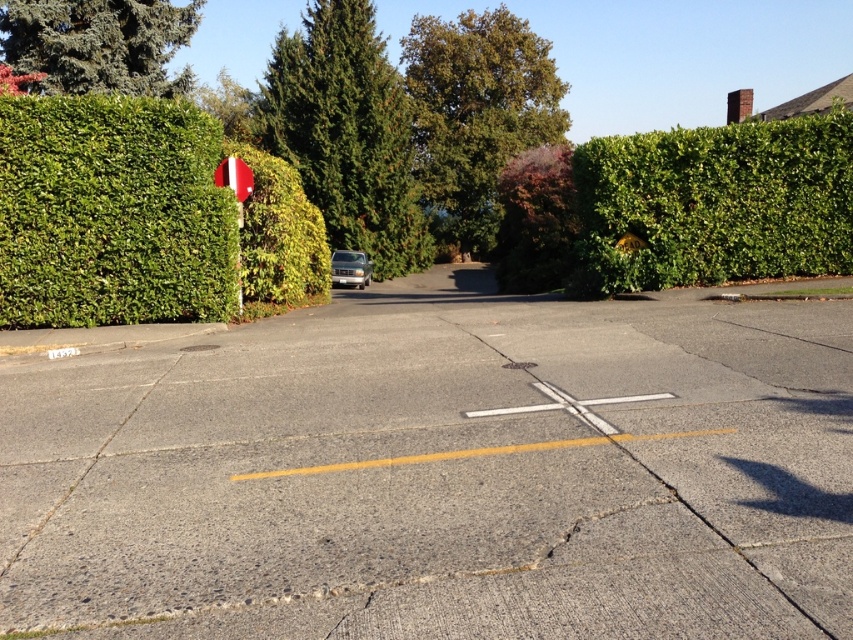
Question: Which point is closer to the camera taking this photo?

Choices:
 (A) (202, 161)
 (B) (26, 16)

Answer: (A)

Question: Is metallic reflective sign at left positioned before metallic pole at left?

Choices:
 (A) yes
 (B) no

Answer: (A)

Question: Does green leafy tree at center appear under metallic reflective sign at left?

Choices:
 (A) yes
 (B) no

Answer: (B)

Question: Which point is farther to the camera?

Choices:
 (A) (663, 216)
 (B) (13, 72)
 (C) (132, 148)

Answer: (B)

Question: Which of the following is the farthest from the observer?

Choices:
 (A) satin silver sedan at center
 (B) green leafy tree at upper left

Answer: (A)

Question: Is green leafy bush at left closer to camera compared to green leafy tree at upper left?

Choices:
 (A) no
 (B) yes

Answer: (B)